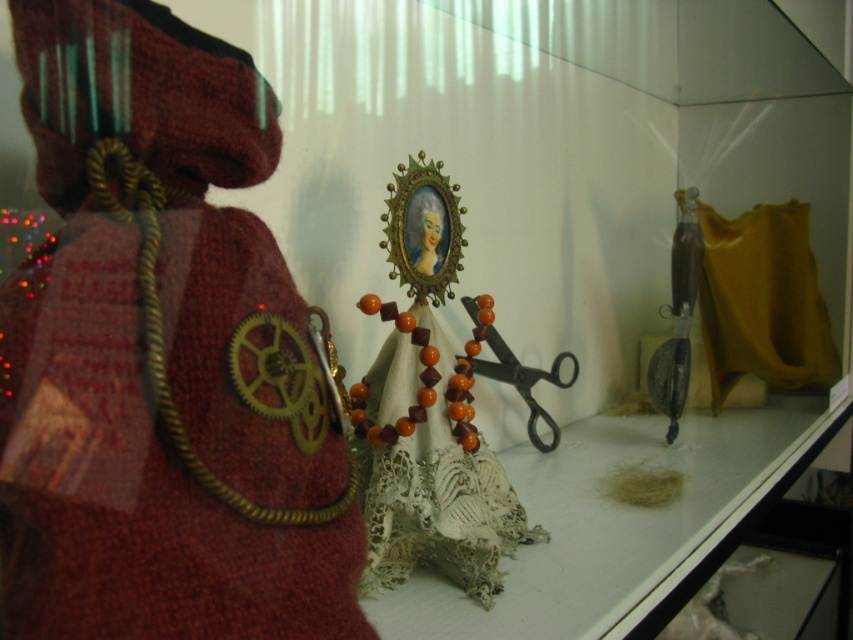
From the picture: Which is below, orange beaded necklace at center or black metal scissors at center?

orange beaded necklace at center is lower down.

Does point (396, 204) lie in front of point (508, 371)?

Yes, point (396, 204) is closer to viewer.

You are a GUI agent. You are given a task and a screenshot of the screen. Output one action in this format:
    pyautogui.click(x=<x>, y=<y>)
    Task: Click on the orange beaded necklace at center
    
    Given the screenshot: What is the action you would take?
    pyautogui.click(x=428, y=416)